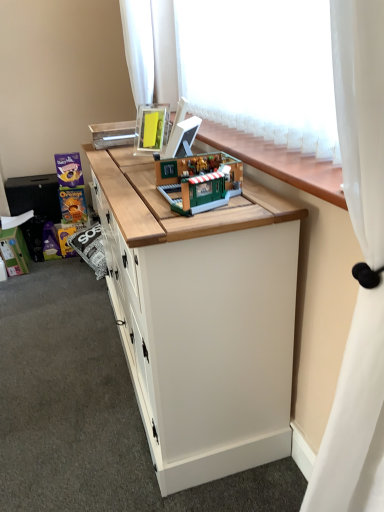
Question: From the image's perspective, relative to white sheer curtain at upper right, placed as the 2th curtain when sorted from top to bottom, is white sheer curtain at upper center, which is the first curtain in top-to-bottom order, above or below?

Choices:
 (A) below
 (B) above

Answer: (B)

Question: Considering the positions of white sheer curtain at upper center, the first curtain viewed from the back, and white sheer curtain at upper right, acting as the 1th curtain starting from the right, in the image, is white sheer curtain at upper center, the first curtain viewed from the back, wider or thinner than white sheer curtain at upper right, acting as the 1th curtain starting from the right,?

Choices:
 (A) wide
 (B) thin

Answer: (B)

Question: Considering the real-world distances, which object is farthest from the brick-like green building at center, the first toy in the right-to-left sequence?

Choices:
 (A) white sheer curtain at upper right, which is the 1th curtain from front to back
 (B) white matte cabinet at center
 (C) matte orange cereal box at left, which appears as the 1th toy when viewed from the left
 (D) wooden counter top at center
 (E) white sheer curtain at upper center, arranged as the 2th curtain when viewed from the front

Answer: (C)

Question: Estimate the real-world distances between objects in this image. Which object is closer to the brick-like green building at center, the first toy in the right-to-left sequence?

Choices:
 (A) white sheer curtain at upper center, which ranks as the second curtain in bottom-to-top order
 (B) matte orange cereal box at left, the 3th toy from the front
 (C) white matte cabinet at center
 (D) white sheer curtain at upper right, the 2th curtain from the back
 (E) wooden counter top at center

Answer: (E)